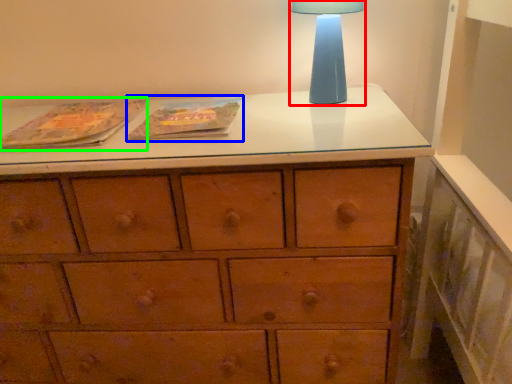
Question: Based on their relative distances, which object is farther from table lamp (highlighted by a red box)? Choose from paperback book (highlighted by a blue box) and paperback book (highlighted by a green box).

Choices:
 (A) paperback book
 (B) paperback book

Answer: (B)